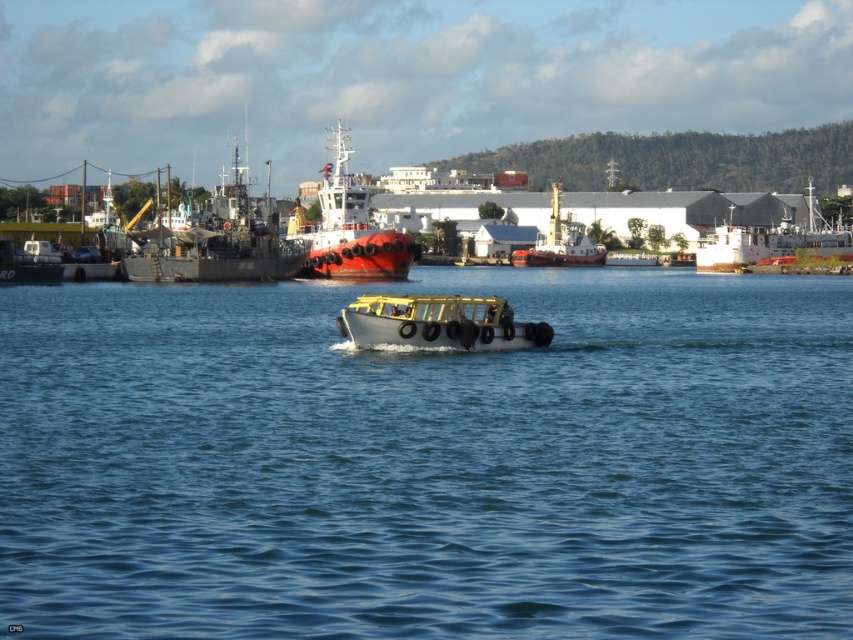
Question: Estimate the real-world distances between objects in this image. Which object is closer to the yellow rubber boat at center?

Choices:
 (A) dark gray metal ship at left
 (B) clear blue water at center
 (C) yellow plastic boat at center
 (D) white matte ship at upper right

Answer: (D)

Question: Does dark gray metal ship at left appear over red glossy ship at center?

Choices:
 (A) no
 (B) yes

Answer: (A)

Question: Which point appears farthest from the camera in this image?

Choices:
 (A) (219, 257)
 (B) (329, 205)
 (C) (569, 227)
 (D) (463, 289)

Answer: (C)

Question: Which of these objects is positioned farthest from the red glossy ship at center?

Choices:
 (A) yellow rubber boat at center
 (B) clear blue water at center
 (C) dark gray metal ship at left

Answer: (A)

Question: Is dark gray metal ship at left above yellow rubber boat at center?

Choices:
 (A) no
 (B) yes

Answer: (B)

Question: Does clear blue water at center appear under red glossy ship at center?

Choices:
 (A) no
 (B) yes

Answer: (B)